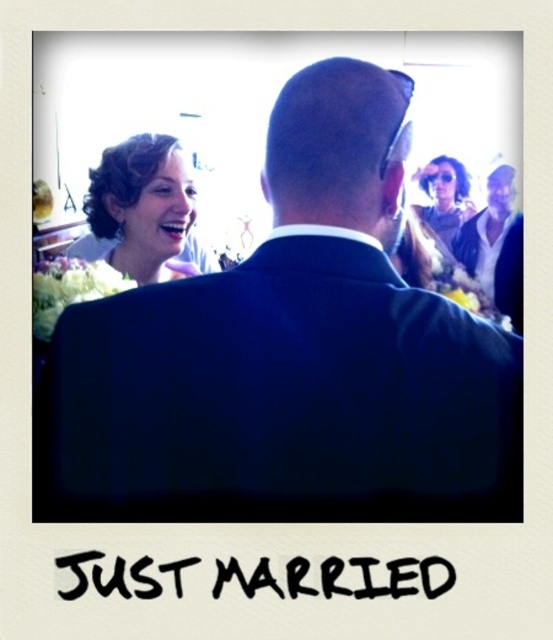
You are a photographer at a wedding. You see the dark blue suit at center and the sunglasses at upper center. Which object is positioned further to the left?

The dark blue suit at center is positioned further to the left than the sunglasses at upper center.

Based on the photo, you are a photographer at a wedding. You need to adjust the lighting so that the blonde hair at upper left and the sunglasses at upper center are both well lit. Which object should you adjust the lighting for first based on their positions?

The blonde hair at upper left is closer to the viewer than the sunglasses at upper center, so you should adjust the lighting for the blonde hair at upper left first to ensure proper exposure.

You are a photographer at a wedding. You notice the dark blue suit at center and the blonde hair at upper left. Which one is positioned to the right of the other?

The dark blue suit at center is positioned to the right of the blonde hair at upper left.